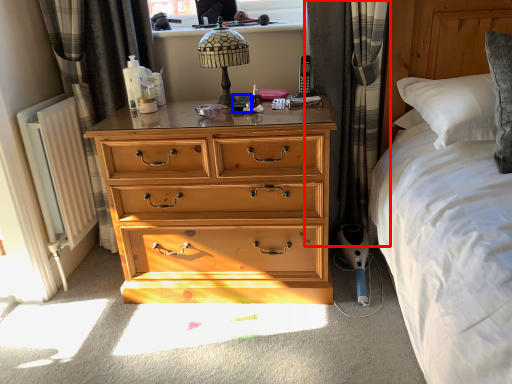
Question: Among these objects, which one is nearest to the camera, curtain (highlighted by a red box) or remote control (highlighted by a blue box)?

Choices:
 (A) curtain
 (B) remote control

Answer: (A)